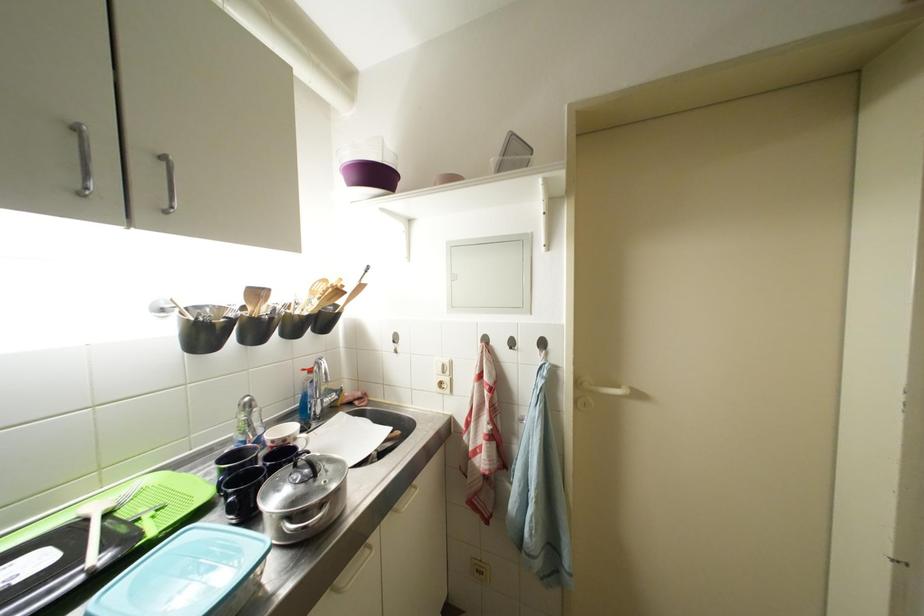
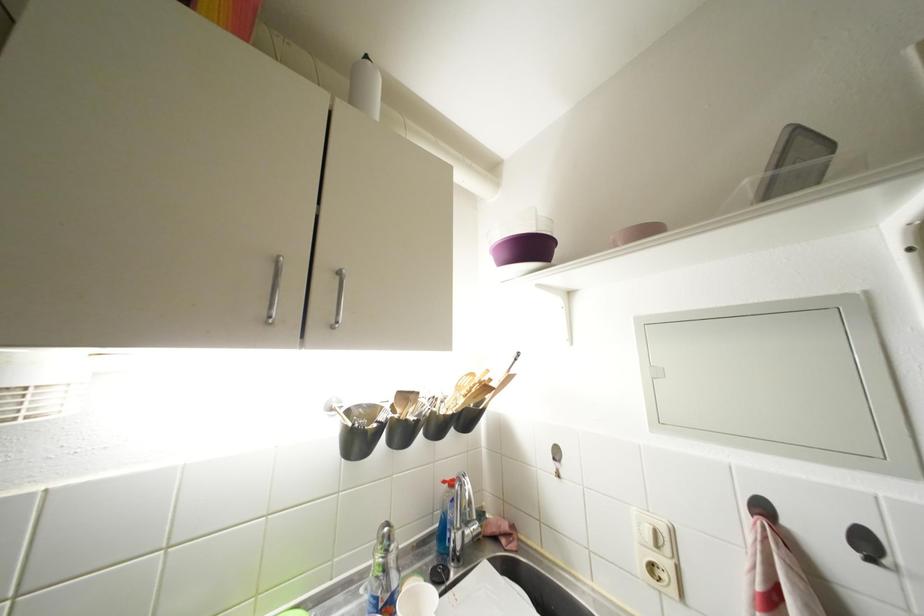
Where in the second image is the point corresponding to point (492, 344) from the first image?

(770, 513)